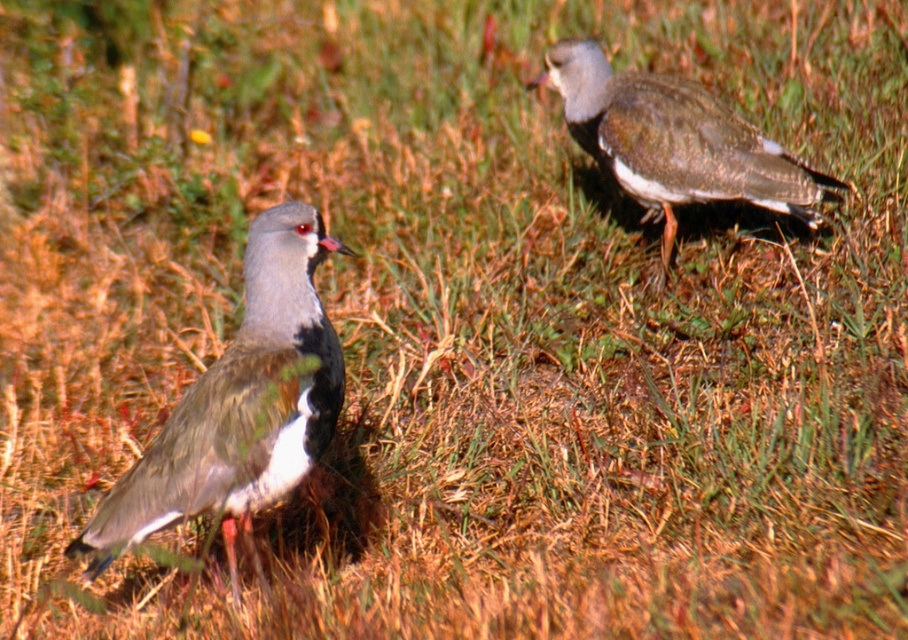
Question: Can you confirm if brown speckled feathers at left is wider than brown speckled feathers at upper right?

Choices:
 (A) no
 (B) yes

Answer: (A)

Question: Can you confirm if brown speckled feathers at left is smaller than brown speckled feathers at upper right?

Choices:
 (A) yes
 (B) no

Answer: (B)

Question: From the image, what is the correct spatial relationship of brown speckled feathers at left in relation to brown speckled feathers at upper right?

Choices:
 (A) right
 (B) left

Answer: (B)